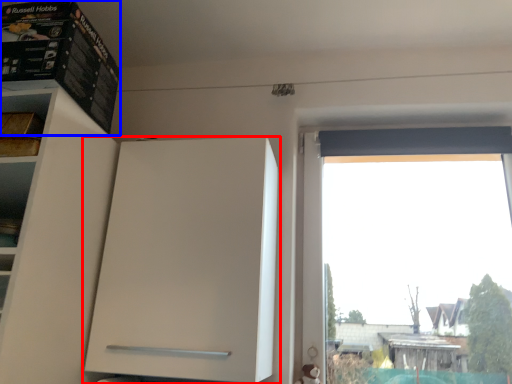
Question: Which object appears farthest to the camera in this image, cabinetry (highlighted by a red box) or cabinet (highlighted by a blue box)?

Choices:
 (A) cabinetry
 (B) cabinet

Answer: (A)